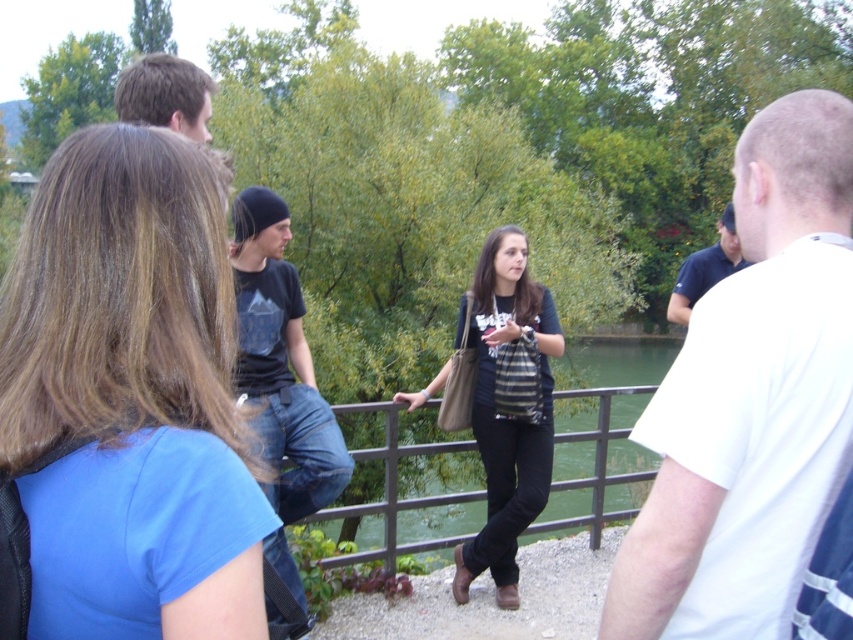
Question: Which point is farther from the camera taking this photo?

Choices:
 (A) (149, 67)
 (B) (805, 156)

Answer: (A)

Question: Can you confirm if white cotton t-shirt at right is positioned below metallic gray rail at center?

Choices:
 (A) no
 (B) yes

Answer: (A)

Question: Can you confirm if black cotton t-shirt at center is thinner than dark brown hair at upper left?

Choices:
 (A) yes
 (B) no

Answer: (A)

Question: Is blue fabric shirt at left closer to the viewer compared to black cotton shirt at upper left?

Choices:
 (A) yes
 (B) no

Answer: (A)

Question: Which point is closer to the camera?

Choices:
 (A) metallic gray rail at center
 (B) black cotton shirt at upper left
 (C) blue fabric shirt at left

Answer: (C)

Question: Based on their relative distances, which object is nearer to the black cotton shirt at upper left?

Choices:
 (A) blue fabric shirt at left
 (B) white cotton t-shirt at right
 (C) striped fabric shirt at center
 (D) black cotton t-shirt at center

Answer: (D)